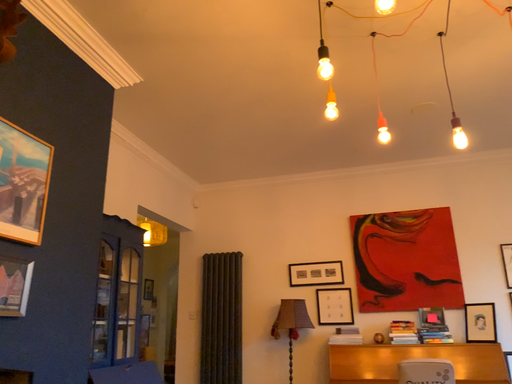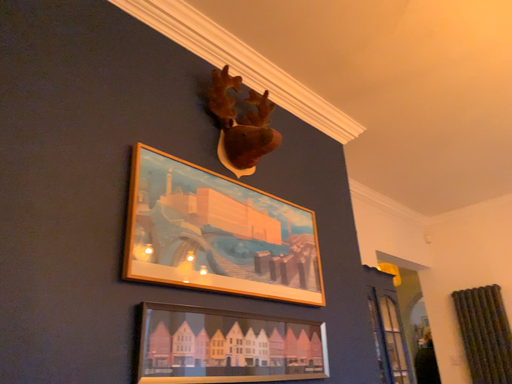
Question: How did the camera likely rotate when shooting the video?

Choices:
 (A) rotated right
 (B) rotated left

Answer: (B)